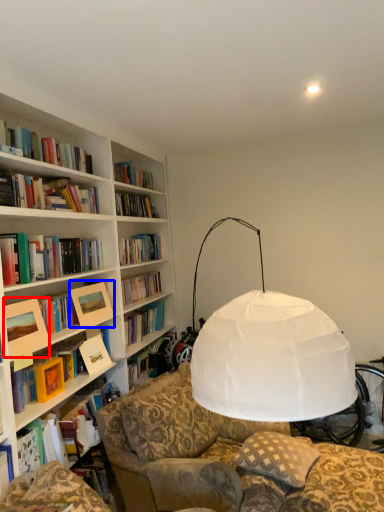
Question: Which point is further to the camera, picture frame (highlighted by a red box) or picture frame (highlighted by a blue box)?

Choices:
 (A) picture frame
 (B) picture frame

Answer: (B)